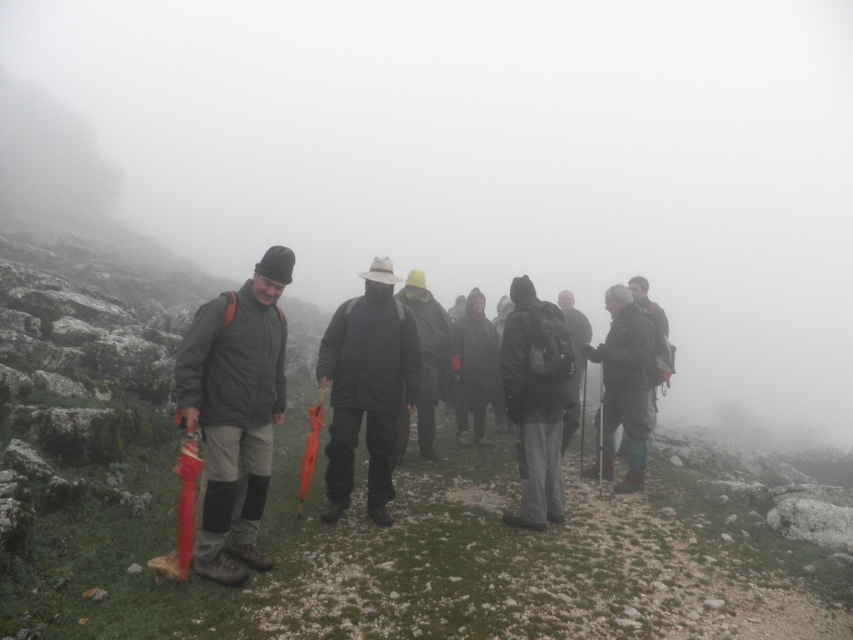
Question: Observing the image, what is the correct spatial positioning of matte black backpack at center in reference to dark gray woolen hat at center?

Choices:
 (A) right
 (B) left

Answer: (A)

Question: Can you confirm if matte gray jacket at left is bigger than dark gray woolen hat at center?

Choices:
 (A) yes
 (B) no

Answer: (B)

Question: Which object is farther from the camera taking this photo?

Choices:
 (A) dark gray woolen hat at center
 (B) dark gray fabric jacket at center
 (C) matte black backpack at center
 (D) matte gray jacket at left

Answer: (B)

Question: Can you confirm if black matte jacket at center is bigger than matte black backpack at center?

Choices:
 (A) yes
 (B) no

Answer: (A)

Question: Considering the real-world distances, which object is farthest from the black matte jacket at center?

Choices:
 (A) dark gray woolen hat at center
 (B) matte black backpack at center
 (C) matte black jacket at center

Answer: (C)

Question: Which object appears farthest from the camera in this image?

Choices:
 (A) dark gray fabric jacket at center
 (B) black matte jacket at center

Answer: (A)